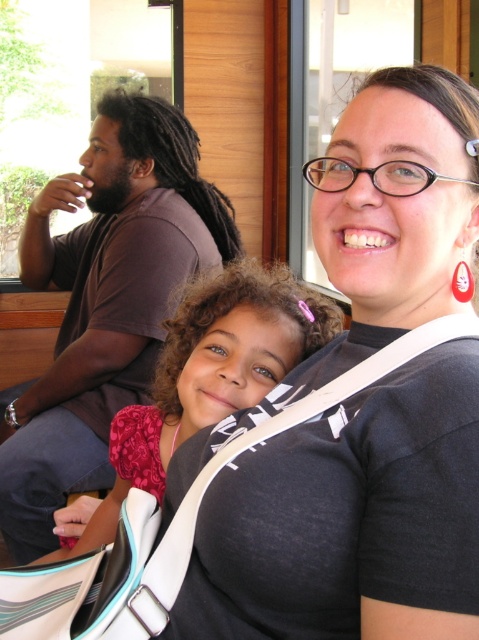
You are a photographer trying to capture a candid shot of the brown cotton shirt at left and the pink fabric at center. Which object should you focus on first if you want to capture both in one frame?

The brown cotton shirt at left is to the left of pink fabric at center, so you should focus on the brown cotton shirt at left first to ensure both are in frame.

You are a photographer trying to capture the brown cotton shirt at left and the pink fabric at center in the same frame. Which object is covering part of the other?

The brown cotton shirt at left is positioned over the pink fabric at center, so it is covering part of it.